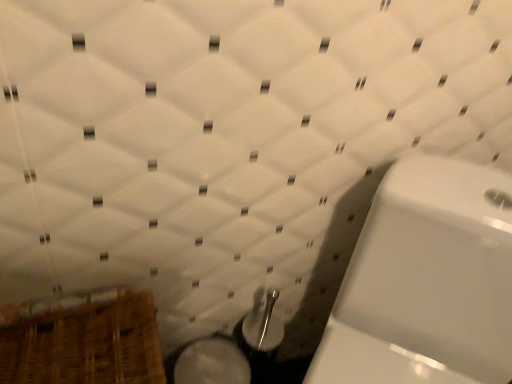
What is the approximate width of white glossy toilet at right?

white glossy toilet at right is 20.73 inches in width.

Locate an element on the screen. wooden basket at lower left is located at coordinates (85, 345).

The height and width of the screenshot is (384, 512). In order to click on white glossy toilet at right in this screenshot , I will do click(426, 282).

Does white glossy toilet at right have a larger size compared to white glossy bidet at lower center?

Indeed, white glossy toilet at right has a larger size compared to white glossy bidet at lower center.

The width and height of the screenshot is (512, 384). Find the location of `toilet on the right of white glossy bidet at lower center`. toilet on the right of white glossy bidet at lower center is located at coordinates (426, 282).

Is white glossy toilet at right facing away from white glossy bidet at lower center?

That's not correct — white glossy toilet at right is not looking away from white glossy bidet at lower center.

What's the angular difference between white glossy toilet at right and white glossy bidet at lower center's facing directions?

white glossy toilet at right and white glossy bidet at lower center are facing 39.7 degrees away from each other.

Considering the positions of objects wooden basket at lower left and white glossy toilet at right in the image provided, who is more to the left, wooden basket at lower left or white glossy toilet at right?

wooden basket at lower left is more to the left.

Between wooden basket at lower left and white glossy toilet at right, which one has smaller width?

With smaller width is wooden basket at lower left.

Is wooden basket at lower left positioned far away from white glossy toilet at right?

No, wooden basket at lower left is not far away from white glossy toilet at right.

Is white glossy toilet at right inside wooden basket at lower left?

No, white glossy toilet at right is not a part of wooden basket at lower left.

What's the angular difference between white glossy bidet at lower center and white glossy toilet at right's facing directions?

They differ by 39.7 degrees in their facing directions.

From a real-world perspective, is white glossy bidet at lower center above or below white glossy toilet at right?

From a real-world perspective, white glossy bidet at lower center is physically below white glossy toilet at right.

Would you say white glossy bidet at lower center is outside white glossy toilet at right?

Yes, white glossy bidet at lower center is located beyond the bounds of white glossy toilet at right.

Is the surface of wooden basket at lower left in direct contact with white glossy bidet at lower center?

No, wooden basket at lower left is not making contact with white glossy bidet at lower center.

Who is bigger, wooden basket at lower left or white glossy bidet at lower center?

wooden basket at lower left is bigger.

Would you say wooden basket at lower left is to the left or to the right of white glossy bidet at lower center in the picture?

Clearly, wooden basket at lower left is on the left of white glossy bidet at lower center in the image.

Can you confirm if wooden basket at lower left is taller than white glossy bidet at lower center?

Indeed, wooden basket at lower left has a greater height compared to white glossy bidet at lower center.

From their relative heights in the image, would you say white glossy toilet at right is taller or shorter than wooden basket at lower left?

In the image, white glossy toilet at right appears to be taller than wooden basket at lower left.

From the image's perspective, who appears lower, white glossy toilet at right or wooden basket at lower left?

wooden basket at lower left.

Consider the image. Are white glossy toilet at right and wooden basket at lower left far apart?

No.

Based on the photo, is white glossy bidet at lower center facing away from wooden basket at lower left?

No, white glossy bidet at lower center is not facing the opposite direction of wooden basket at lower left.

From their relative heights in the image, would you say white glossy bidet at lower center is taller or shorter than wooden basket at lower left?

white glossy bidet at lower center is shorter than wooden basket at lower left.

Which is less distant, (193, 345) or (134, 354)?

Point (193, 345) is positioned farther from the camera compared to point (134, 354).

Is white glossy bidet at lower center surrounding wooden basket at lower left?

No, white glossy bidet at lower center does not contain wooden basket at lower left.

Image resolution: width=512 pixels, height=384 pixels. Identify the location of toilet lying above the white glossy bidet at lower center (from the image's perspective). (426, 282).

Where is `basket behind the white glossy toilet at right`? The width and height of the screenshot is (512, 384). basket behind the white glossy toilet at right is located at coordinates (85, 345).

Based on their spatial positions, is white glossy toilet at right or wooden basket at lower left further from white glossy bidet at lower center?

Based on the image, white glossy toilet at right appears to be further to white glossy bidet at lower center.

Considering their positions, is white glossy bidet at lower center positioned further to white glossy toilet at right than wooden basket at lower left?

Among the two, wooden basket at lower left is located further to white glossy toilet at right.

Considering their positions, is white glossy toilet at right positioned further to wooden basket at lower left than white glossy bidet at lower center?

white glossy toilet at right.

Based on their spatial positions, is wooden basket at lower left or white glossy bidet at lower center closer to white glossy toilet at right?

The object closer to white glossy toilet at right is white glossy bidet at lower center.

Estimate the real-world distances between objects in this image. Which object is closer to white glossy bidet at lower center, wooden basket at lower left or white glossy toilet at right?

wooden basket at lower left lies closer to white glossy bidet at lower center than the other object.

Looking at this image, looking at the image, which one is located closer to wooden basket at lower left, white glossy bidet at lower center or white glossy toilet at right?

Among the two, white glossy bidet at lower center is located nearer to wooden basket at lower left.

This screenshot has width=512, height=384. Identify the location of bidet between wooden basket at lower left and white glossy toilet at right in the horizontal direction. (212, 362).